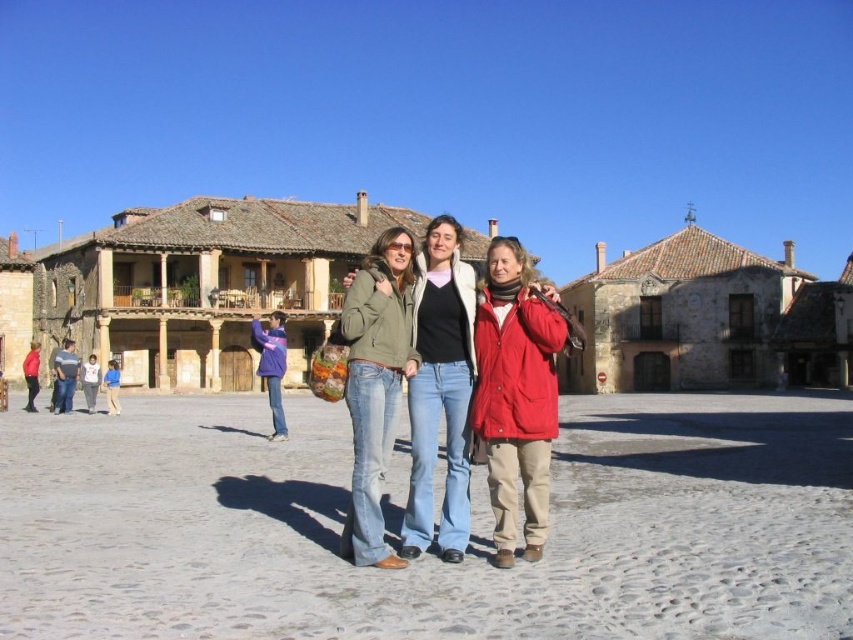
You are a photographer trying to capture a closeup of the purple fleece jacket at lower left and the blue denim jeans at lower left. Since you want to focus on both items equally, which one should you zoom in on more to ensure they appear the same size in the photo?

The purple fleece jacket at lower left is larger in size than the blue denim jeans at lower left. To make them appear the same size in the photo, you should zoom in more on the smaller blue denim jeans at lower left so that it enlarges to match the size of the larger purple fleece jacket at lower left.

You are a photographer standing in the historic town square and want to take a photo that includes both the matte red jacket at center and the purple fleece jacket at lower left. Which jacket should you focus on first to ensure both are in sharp focus?

You should focus on the matte red jacket at center first because it is closer to the viewer than the purple fleece jacket at lower left. By focusing on the closer object, the depth of field may allow the farther object to also be in focus.